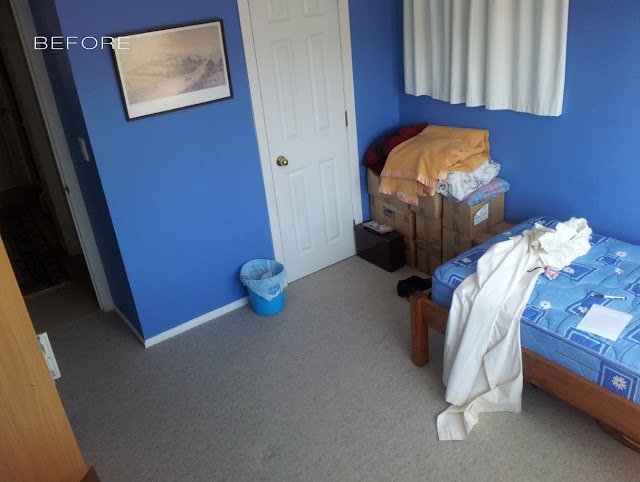
At what (x,y) coordinates should I click in order to perform the action: click on blue walls. Please return your answer as a coordinate pair (x, y). Image resolution: width=640 pixels, height=482 pixels. Looking at the image, I should click on (201, 199), (611, 196).